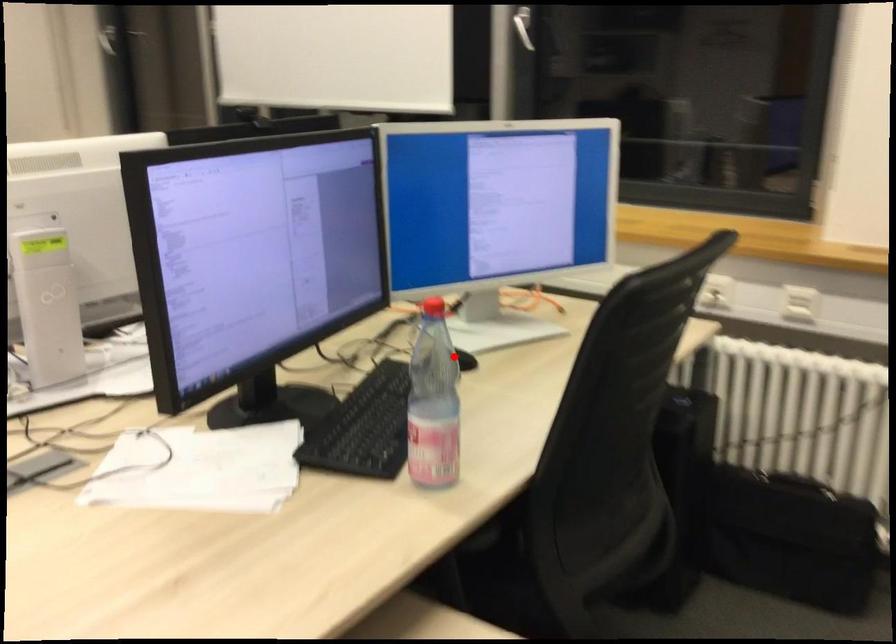
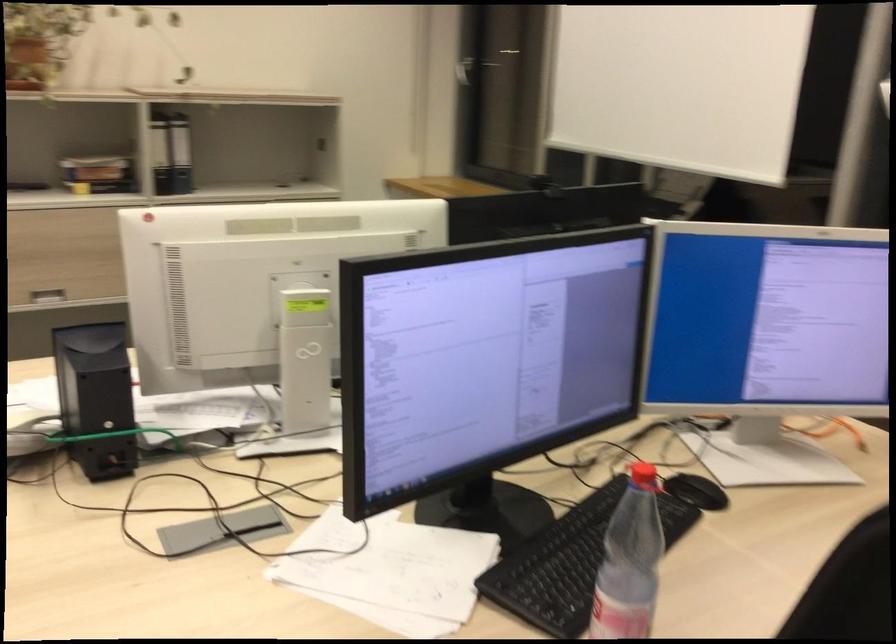
Question: I am providing you with two images of the same scene from different viewpoints. In image1, a red point is highlighted. Considering the same 3D point in image2, which of the following is correct?

Choices:
 (A) It is closer
 (B) It is farther

Answer: (A)